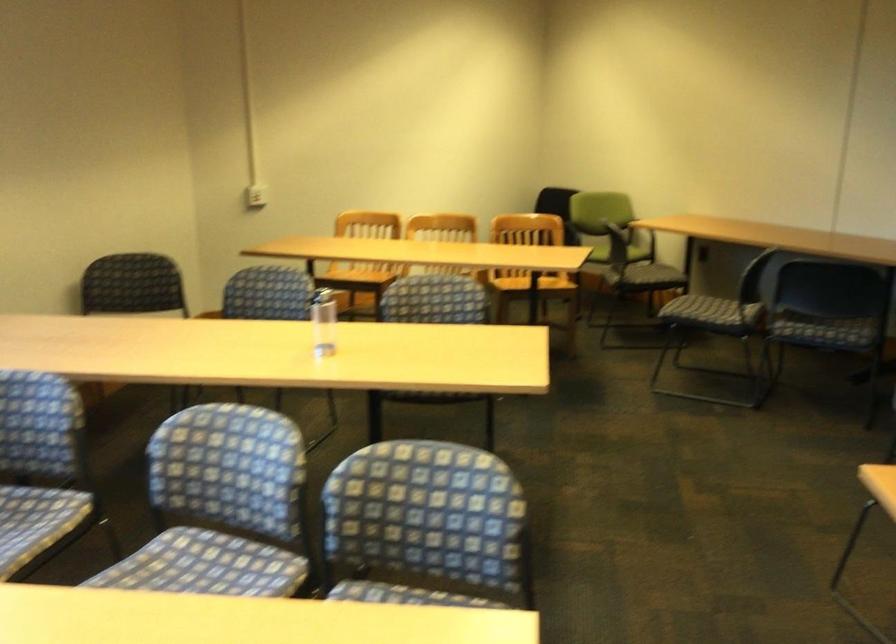
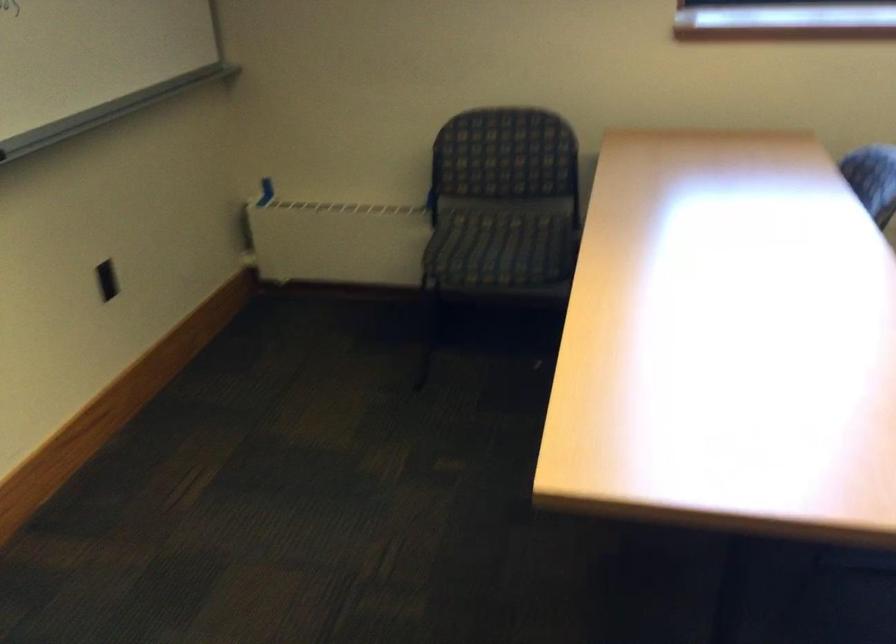
The images are taken continuously from a first-person perspective. In which direction is your viewpoint rotating?

The rotation direction of the camera is left-down.